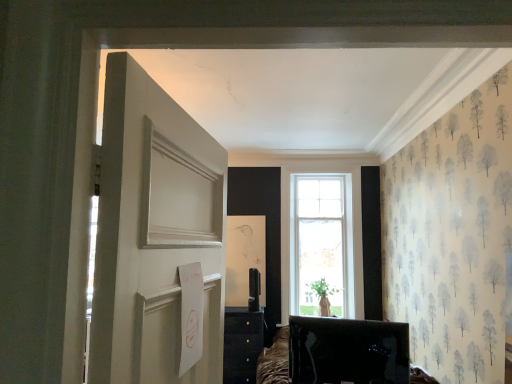
Question: Considering the positions of white painted wood door at left and matte black tv at lower center in the image, is white painted wood door at left taller or shorter than matte black tv at lower center?

Choices:
 (A) tall
 (B) short

Answer: (A)

Question: Does point (114, 76) appear closer or farther from the camera than point (296, 380)?

Choices:
 (A) closer
 (B) farther

Answer: (A)

Question: In the image, is white painted wood door at left positioned in front of or behind matte black tv at lower center?

Choices:
 (A) front
 (B) behind

Answer: (A)

Question: Considering the relative positions of matte black tv at lower center and white painted wood door at left in the image provided, is matte black tv at lower center to the left or to the right of white painted wood door at left?

Choices:
 (A) right
 (B) left

Answer: (A)

Question: Is matte black tv at lower center wider or thinner than white painted wood door at left?

Choices:
 (A) wide
 (B) thin

Answer: (A)

Question: Based on their sizes in the image, would you say matte black tv at lower center is bigger or smaller than white painted wood door at left?

Choices:
 (A) big
 (B) small

Answer: (B)

Question: Do you think matte black tv at lower center is within white painted wood door at left, or outside of it?

Choices:
 (A) inside
 (B) outside

Answer: (B)